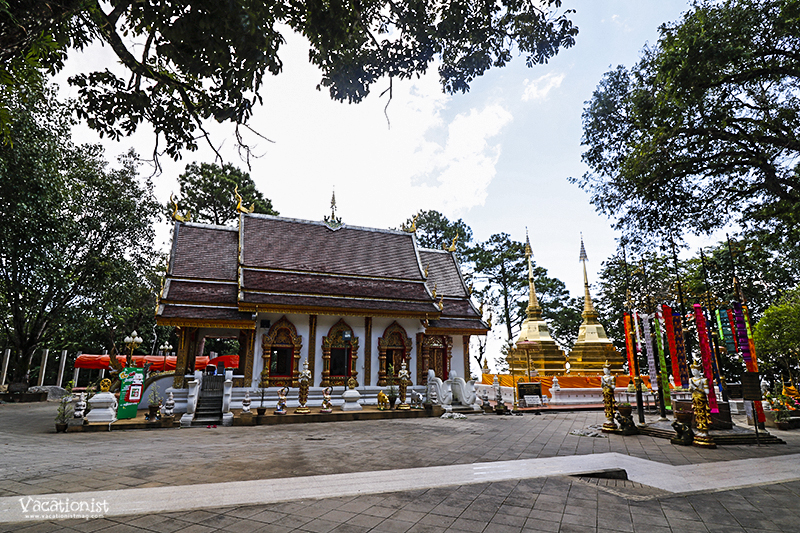
Locate an element on the screen. The width and height of the screenshot is (800, 533). buddha statues is located at coordinates (304, 384), (404, 381).